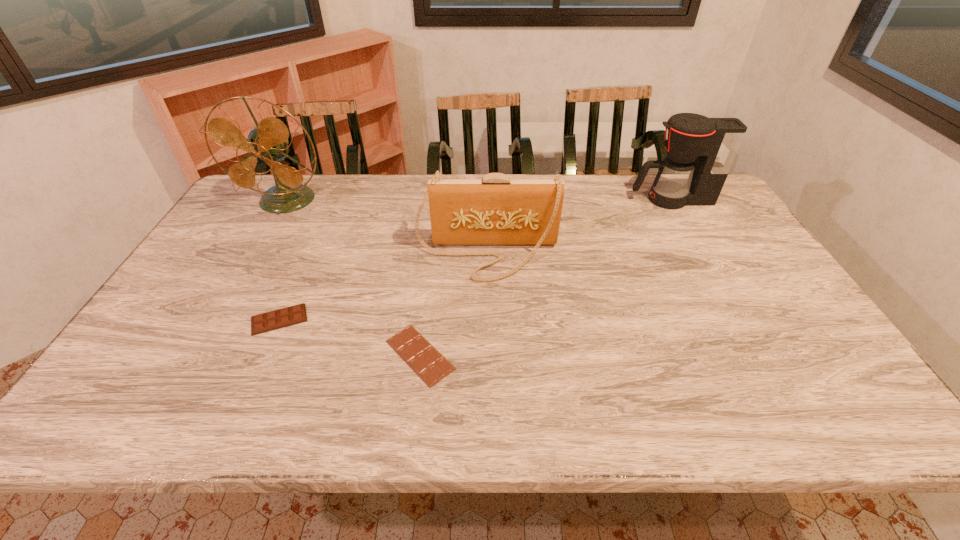
Where is `vacant area that lies between the third tallest object and the taller chocolate bar`? The height and width of the screenshot is (540, 960). vacant area that lies between the third tallest object and the taller chocolate bar is located at coordinates (383, 287).

Identify the location of free spot between the left chocolate bar and the fan. [283, 260].

This screenshot has width=960, height=540. Identify the location of free space between the shortest object and the third tallest object. (453, 304).

The height and width of the screenshot is (540, 960). I want to click on free space between the fan and the left chocolate bar, so click(x=283, y=260).

Locate an element on the screen. The height and width of the screenshot is (540, 960). unoccupied area between the left chocolate bar and the fan is located at coordinates (283, 260).

Locate an element on the screen. The image size is (960, 540). free spot between the taller chocolate bar and the coffee maker is located at coordinates (x=475, y=259).

This screenshot has height=540, width=960. I want to click on vacant space in between the third farthest object and the fourth shortest object, so click(579, 227).

Where is `free space between the coffee maker and the right chocolate bar`? free space between the coffee maker and the right chocolate bar is located at coordinates (545, 277).

What are the coordinates of `free area in between the shortest object and the taller chocolate bar` in the screenshot? It's located at (349, 337).

Where is `object that is the third closest to the third tallest object`? object that is the third closest to the third tallest object is located at coordinates pyautogui.click(x=700, y=151).